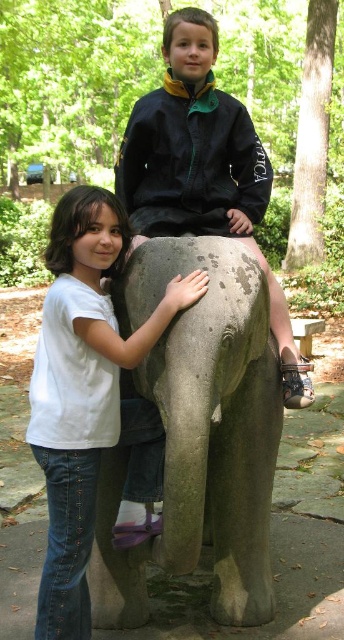
Based on the photo, between gray matte elephant at center and white matte shirt at left, which one appears on the left side from the viewer's perspective?

white matte shirt at left

Who is positioned more to the right, gray matte elephant at center or white matte shirt at left?

From the viewer's perspective, gray matte elephant at center appears more on the right side.

Is point (243, 419) in front of point (110, 308)?

No, it is not.

Where is `gray matte elephant at center`? gray matte elephant at center is located at coordinates (198, 433).

Between point (231, 552) and point (143, 145), which one is positioned in front?

Positioned in front is point (231, 552).

The width and height of the screenshot is (344, 640). What are the coordinates of `gray matte elephant at center` in the screenshot? It's located at (198, 433).

Locate an element on the screen. gray matte elephant at center is located at coordinates (198, 433).

What do you see at coordinates (91, 401) in the screenshot? This screenshot has width=344, height=640. I see `white matte shirt at left` at bounding box center [91, 401].

At what (x,y) coordinates should I click in order to perform the action: click on white matte shirt at left. Please return your answer as a coordinate pair (x, y). The image size is (344, 640). Looking at the image, I should click on (91, 401).